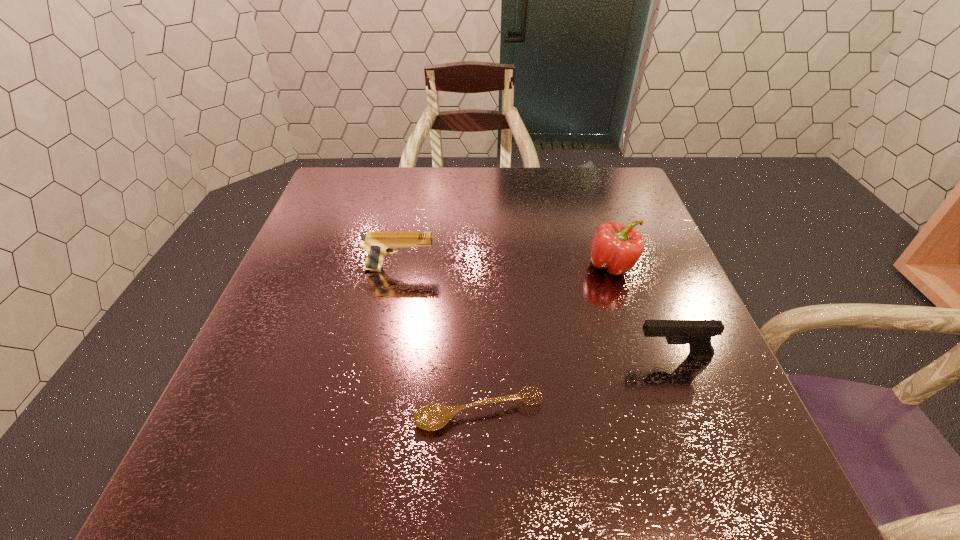
Where is `pepper`? This screenshot has width=960, height=540. pepper is located at coordinates (616, 248).

Where is `the left pistol`? This screenshot has width=960, height=540. the left pistol is located at coordinates (378, 244).

The image size is (960, 540). I want to click on the nearer pistol, so click(698, 333).

At what (x,y) coordinates should I click in order to perform the action: click on the second nearest object. Please return your answer as a coordinate pair (x, y). This screenshot has height=540, width=960. Looking at the image, I should click on (698, 333).

Where is `the shortest object`? The height and width of the screenshot is (540, 960). the shortest object is located at coordinates (434, 416).

Identify the location of ladle. The image size is (960, 540). (434, 416).

The height and width of the screenshot is (540, 960). I want to click on free region located on the front of the pepper, so click(x=639, y=350).

You are a GUI agent. You are given a task and a screenshot of the screen. Output one action in this format:
    pyautogui.click(x=<x>, y=<y>)
    Task: Click on the vacant space situated at the barrel of the left pistol
    This screenshot has width=960, height=540.
    Given the screenshot: What is the action you would take?
    pyautogui.click(x=542, y=269)

Identify the location of vacant space located 0.290m on the front-facing side of the nearer pistol. The height and width of the screenshot is (540, 960). (482, 356).

Where is `vacant area situated on the front-facing side of the nearer pistol`? This screenshot has height=540, width=960. vacant area situated on the front-facing side of the nearer pistol is located at coordinates (591, 356).